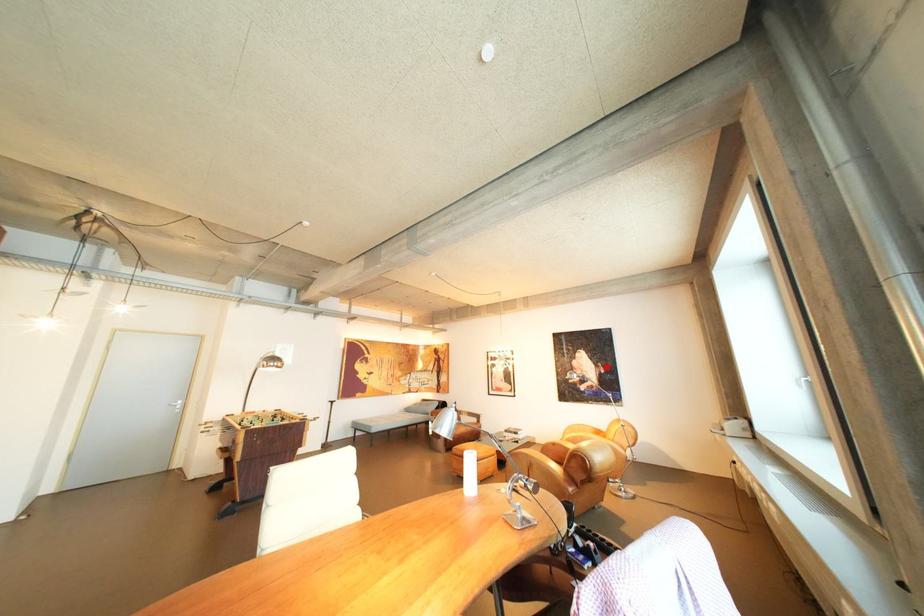
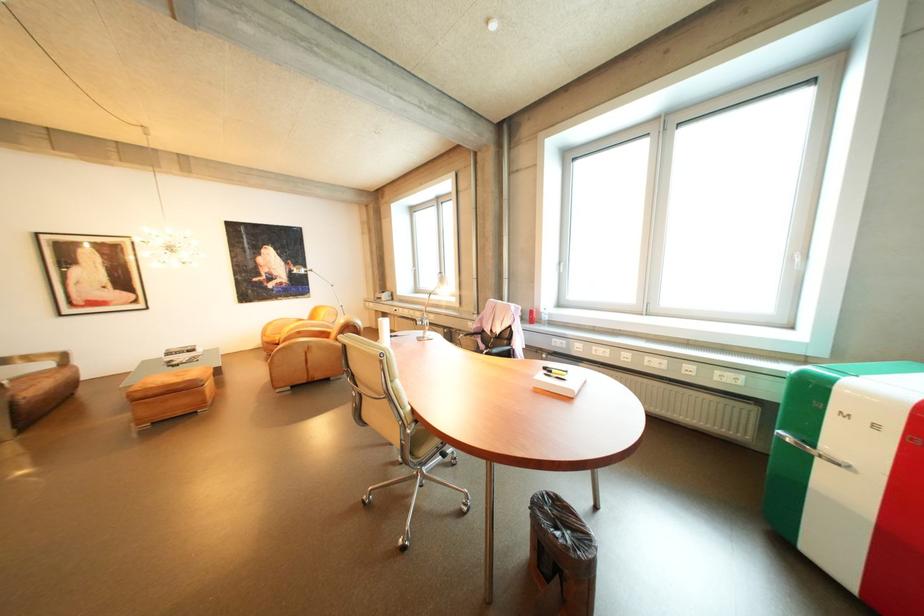
The point at the highlighted location is marked in the first image. Where is the corresponding point in the second image?

(296, 264)